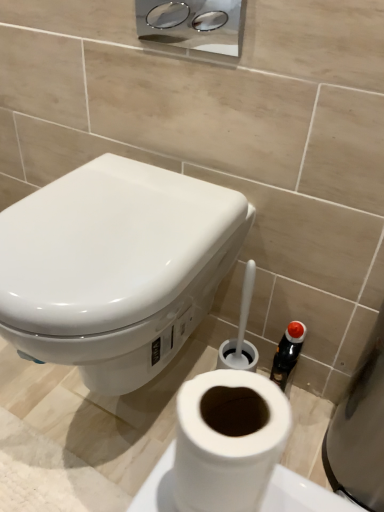
Question: Is chrome metallic dispenser at upper center shorter than white glossy toilet at upper left?

Choices:
 (A) yes
 (B) no

Answer: (A)

Question: Is chrome metallic dispenser at upper center not close to white glossy toilet at upper left?

Choices:
 (A) no
 (B) yes

Answer: (A)

Question: Does chrome metallic dispenser at upper center appear on the right side of white glossy toilet at upper left?

Choices:
 (A) yes
 (B) no

Answer: (A)

Question: From the image's perspective, would you say chrome metallic dispenser at upper center is positioned over white glossy toilet at upper left?

Choices:
 (A) yes
 (B) no

Answer: (A)

Question: From a real-world perspective, is chrome metallic dispenser at upper center on top of white glossy toilet at upper left?

Choices:
 (A) yes
 (B) no

Answer: (A)

Question: Is the depth of chrome metallic dispenser at upper center greater than that of white glossy toilet at upper left?

Choices:
 (A) yes
 (B) no

Answer: (A)

Question: Are white matte toilet paper at lower center and chrome metallic dispenser at upper center located far from each other?

Choices:
 (A) yes
 (B) no

Answer: (A)

Question: Can you confirm if white matte toilet paper at lower center is taller than chrome metallic dispenser at upper center?

Choices:
 (A) no
 (B) yes

Answer: (A)

Question: From the image's perspective, is white matte toilet paper at lower center over chrome metallic dispenser at upper center?

Choices:
 (A) yes
 (B) no

Answer: (B)

Question: Can chrome metallic dispenser at upper center be found inside white matte toilet paper at lower center?

Choices:
 (A) no
 (B) yes

Answer: (A)

Question: Is white matte toilet paper at lower center not inside chrome metallic dispenser at upper center?

Choices:
 (A) no
 (B) yes

Answer: (B)

Question: From a real-world perspective, is white matte toilet paper at lower center physically below chrome metallic dispenser at upper center?

Choices:
 (A) yes
 (B) no

Answer: (A)

Question: Is white glossy toilet at upper left far away from chrome metallic dispenser at upper center?

Choices:
 (A) no
 (B) yes

Answer: (A)